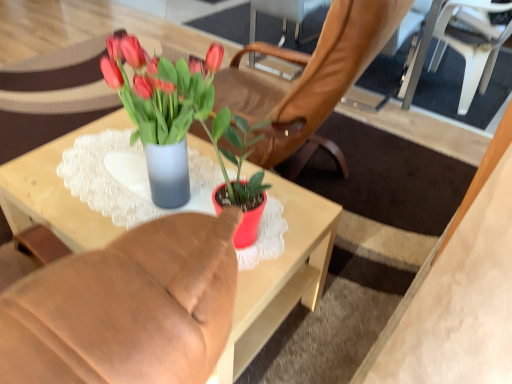
Question: Is point [280, 198] closer or farther from the camera than point [495, 49]?

Choices:
 (A) closer
 (B) farther

Answer: (A)

Question: From a real-world perspective, is matte glass vase at center above or below white plastic chair at upper right?

Choices:
 (A) above
 (B) below

Answer: (B)

Question: Considering the relative positions of matte glass vase at center and white plastic chair at upper right in the image provided, is matte glass vase at center to the left or to the right of white plastic chair at upper right?

Choices:
 (A) left
 (B) right

Answer: (A)

Question: From their relative heights in the image, would you say white plastic chair at upper right is taller or shorter than matte glass vase at center?

Choices:
 (A) short
 (B) tall

Answer: (B)

Question: From a real-world perspective, is white plastic chair at upper right physically located above or below matte glass vase at center?

Choices:
 (A) below
 (B) above

Answer: (B)

Question: Based on their sizes in the image, would you say white plastic chair at upper right is bigger or smaller than matte glass vase at center?

Choices:
 (A) big
 (B) small

Answer: (A)

Question: Considering the relative positions of white plastic chair at upper right and matte glass vase at center in the image provided, is white plastic chair at upper right to the left or to the right of matte glass vase at center?

Choices:
 (A) left
 (B) right

Answer: (B)